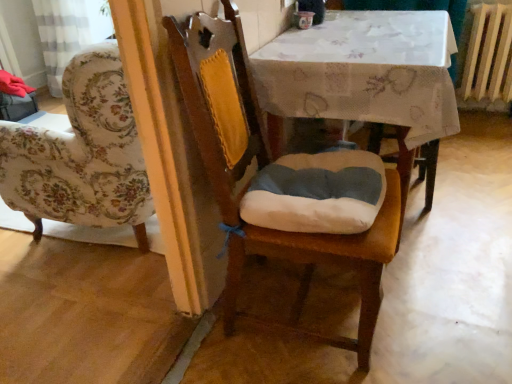
Question: Considering their positions, is wooden radiator at right located in front of or behind wooden chair at center?

Choices:
 (A) behind
 (B) front

Answer: (A)

Question: Would you say wooden radiator at right is to the left or to the right of wooden chair at center in the picture?

Choices:
 (A) left
 (B) right

Answer: (B)

Question: Which object is positioned closest to the wooden radiator at right?

Choices:
 (A) wooden chair at center
 (B) white fabric table at center

Answer: (B)

Question: Which object is positioned closest to the white fabric table at center?

Choices:
 (A) wooden chair at center
 (B) wooden radiator at right

Answer: (A)